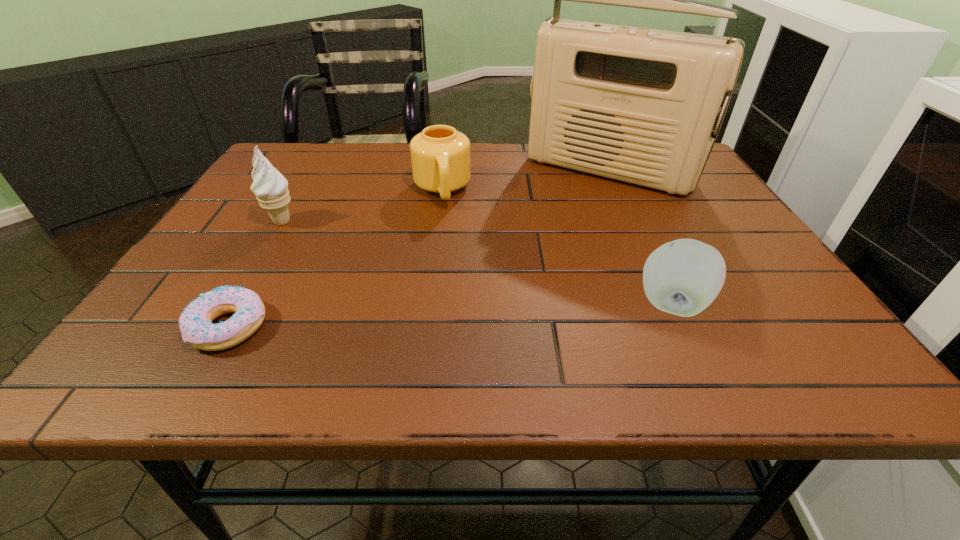
I want to click on doughnut, so click(195, 323).

Identify the location of apple. The width and height of the screenshot is (960, 540). (683, 277).

Locate an element on the screen. icecream is located at coordinates (270, 187).

This screenshot has width=960, height=540. Find the location of `the fourth shortest object`. the fourth shortest object is located at coordinates (270, 187).

Locate an element on the screen. the third object from right to left is located at coordinates (440, 156).

Locate an element on the screen. radio receiver is located at coordinates (638, 105).

Image resolution: width=960 pixels, height=540 pixels. In order to click on free space located 0.050m on the back of the shortest object in this screenshot , I will do `click(255, 283)`.

Locate an element on the screen. free space located 0.070m on the back of the apple is located at coordinates (652, 259).

At what (x,y) coordinates should I click in order to perform the action: click on free space located on the front-facing side of the third nearest object. Please return your answer as a coordinate pair (x, y). Looking at the image, I should click on (313, 241).

The image size is (960, 540). Find the location of `blank space located on the front-facing side of the third nearest object`. blank space located on the front-facing side of the third nearest object is located at coordinates (379, 281).